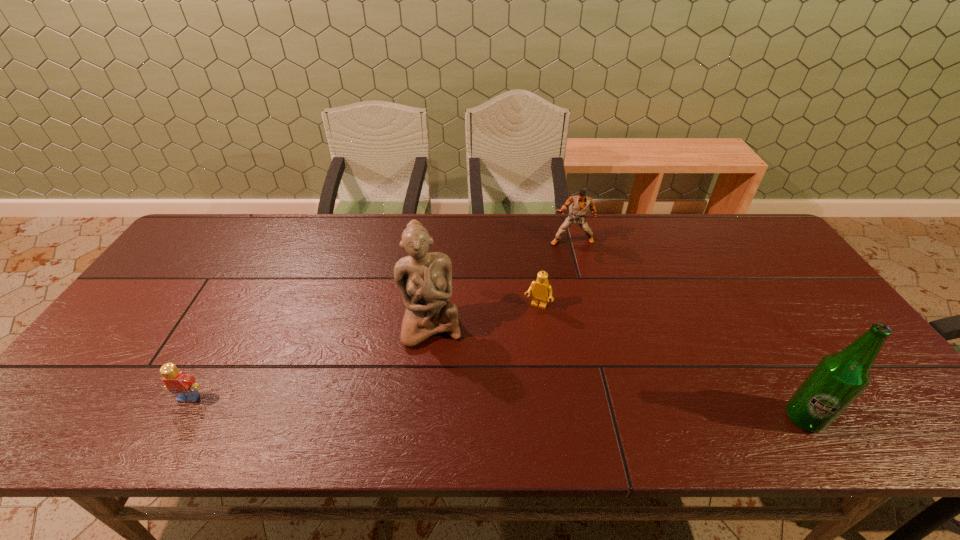
This screenshot has width=960, height=540. What are the coordinates of `free space at the far edge of the desktop` in the screenshot? It's located at (552, 239).

At what (x,y) coordinates should I click in order to perform the action: click on vacant space at the near edge of the desktop. Please return your answer as a coordinate pair (x, y). Looking at the image, I should click on (772, 373).

In the image, there is a desktop. Where is `free space at the left edge`? free space at the left edge is located at coordinates (188, 306).

At what (x,y) coordinates should I click in order to perform the action: click on vacant space at the right edge of the desktop. Please return your answer as a coordinate pair (x, y). Looking at the image, I should click on (778, 267).

Identify the location of free space at the far left corner of the desktop. (210, 237).

Locate an element on the screen. This screenshot has height=540, width=960. blank space at the far right corner of the desktop is located at coordinates (739, 232).

Locate an element on the screen. vacant space in between the figurine and the fourth object from left to right is located at coordinates (501, 283).

I want to click on blank region between the rightmost object and the third shortest object, so click(688, 329).

Find the location of a particular element. vacant point located between the rightmost object and the second object from right to left is located at coordinates (688, 329).

What are the coordinates of `free space between the leftmost object and the fourth object from right to left` in the screenshot? It's located at (310, 361).